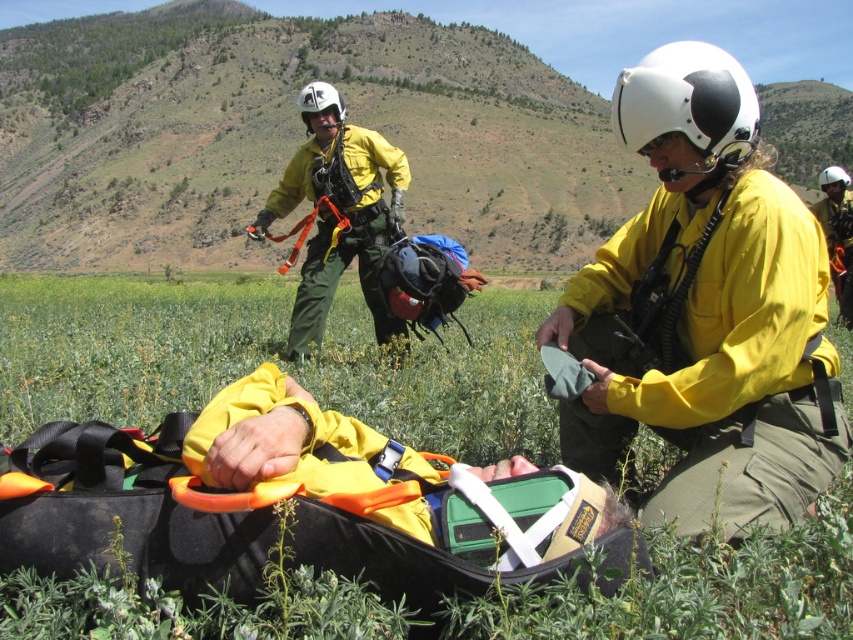
In the scene shown: You are a rescue worker in the mountain area. You need to secure a rope between the two points marked as point [76,616] and point [833,186]. Which point should you start tying the rope first to ensure it goes from the front to the back?

You should start tying the rope at point [76,616] first because it is in front of point [833,186], so the rope will go from front to back.

You are a rescue worker in the mountain area. You need to secure the stretcher with a helmet that has a wider base for stability. Which helmet should you choose between the yellow matte helmet at center and the yellow fabric helmet at upper right?

The yellow fabric helmet at upper right has a wider width than the yellow matte helmet at center, so you should choose the yellow fabric helmet at upper right for securing the stretcher because it provides a wider base for stability.

Looking at this image, you are a hiker who just arrived at the scene. You need to quickly assess the situation. Which object is closer to you, the green grassy at lower center or the yellow fabric helmet at upper right?

The green grassy at lower center is closer to you because it is positioned lower in the scene, while the yellow fabric helmet at upper right is placed higher up, indicating it is further away.